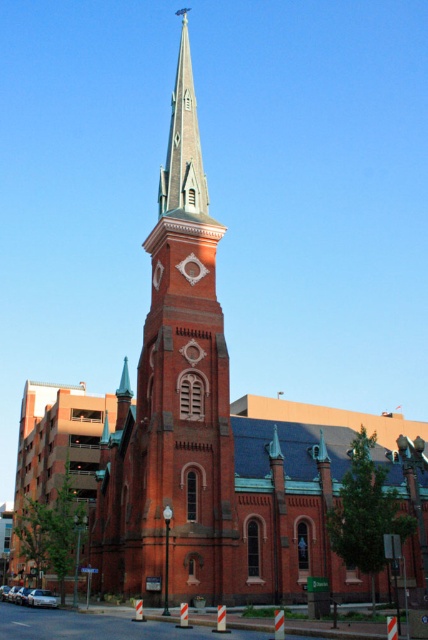
Can you confirm if brick steeple at center is bigger than smooth gray steeple at center?

Correct, brick steeple at center is larger in size than smooth gray steeple at center.

From the picture: Is brick steeple at center closer to the viewer compared to smooth gray steeple at center?

Yes, brick steeple at center is in front of smooth gray steeple at center.

Is point (198, 460) closer to camera compared to point (184, 28)?

Yes, point (198, 460) is in front of point (184, 28).

Identify the location of brick steeple at center. The width and height of the screenshot is (428, 640). (174, 401).